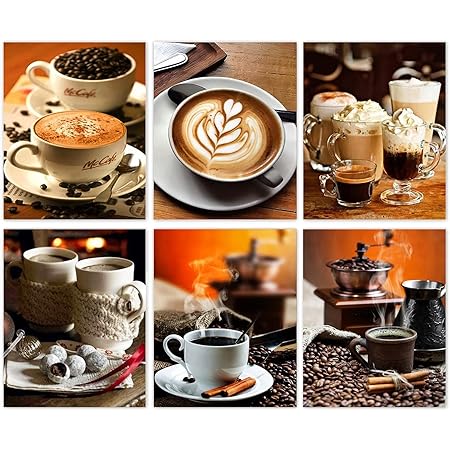
Where is `clear cups of coffee`? clear cups of coffee is located at coordinates (329, 113), (363, 134), (404, 143), (411, 97), (353, 178).